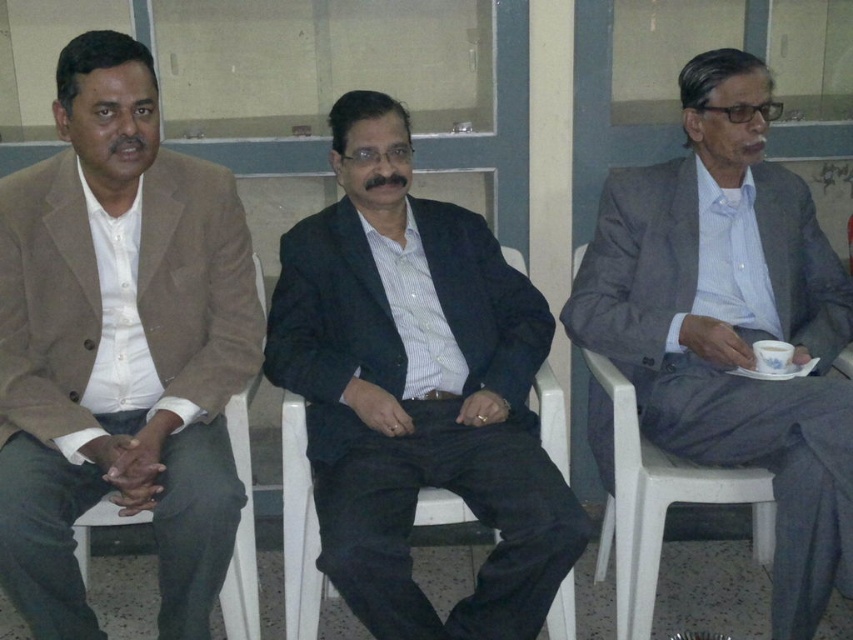
Question: Is matte brown blazer at left positioned in front of gray fabric suit at right?

Choices:
 (A) no
 (B) yes

Answer: (B)

Question: Is matte brown blazer at left smaller than gray fabric suit at right?

Choices:
 (A) no
 (B) yes

Answer: (B)

Question: Considering the real-world distances, which object is farthest from the white plastic chair at left?

Choices:
 (A) dark blue suit at center
 (B) gray fabric suit at right
 (C) white ceramic cup at center right
 (D) matte brown blazer at left

Answer: (C)

Question: Estimate the real-world distances between objects in this image. Which object is farther from the gray fabric suit at right?

Choices:
 (A) matte brown blazer at left
 (B) white plastic chair at left
 (C) dark blue suit at center

Answer: (A)

Question: Which of the following is the closest to the observer?

Choices:
 (A) gray fabric suit at right
 (B) matte brown blazer at left

Answer: (B)

Question: Is the position of white plastic chair at left less distant than that of white ceramic cup at center right?

Choices:
 (A) no
 (B) yes

Answer: (B)